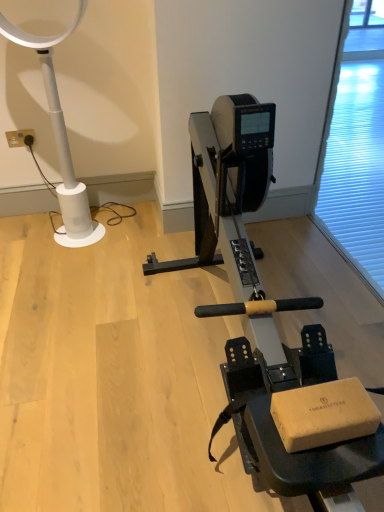
The height and width of the screenshot is (512, 384). I want to click on transparent plastic screen door at right, so click(355, 149).

You are a GUI agent. You are given a task and a screenshot of the screen. Output one action in this format:
    pyautogui.click(x=<x>, y=<y>)
    Task: Click on the white plastic lamp at left
    Image resolution: width=384 pixels, height=512 pixels.
    Given the screenshot: What is the action you would take?
    pyautogui.click(x=61, y=140)

What do you see at coordinates (61, 140) in the screenshot? The width and height of the screenshot is (384, 512). I see `white plastic lamp at left` at bounding box center [61, 140].

This screenshot has height=512, width=384. I want to click on metallic silver stationary bicycle at center, so click(x=261, y=310).

From the image's perspective, is metallic silver stationary bicycle at center above white plastic lamp at left?

No.

Considering the positions of objects metallic silver stationary bicycle at center and white plastic lamp at left in the image provided, who is more to the left, metallic silver stationary bicycle at center or white plastic lamp at left?

white plastic lamp at left.

Would you say metallic silver stationary bicycle at center is a long distance from white plastic lamp at left?

No, metallic silver stationary bicycle at center is not far away from white plastic lamp at left.

From the picture: Is white plastic electric outlet at upper left taller than metallic silver stationary bicycle at center?

No, white plastic electric outlet at upper left is not taller than metallic silver stationary bicycle at center.

Do you think white plastic electric outlet at upper left is within metallic silver stationary bicycle at center, or outside of it?

white plastic electric outlet at upper left is located beyond the bounds of metallic silver stationary bicycle at center.

I want to click on electric outlet lying above the metallic silver stationary bicycle at center (from the image's perspective), so click(x=20, y=138).

How distant is white plastic electric outlet at upper left from metallic silver stationary bicycle at center?

white plastic electric outlet at upper left is 4.95 feet from metallic silver stationary bicycle at center.

Is transparent plastic screen door at right next to white plastic lamp at left and touching it?

transparent plastic screen door at right is not next to white plastic lamp at left, and they're not touching.

Based on their positions, is transparent plastic screen door at right located to the left or right of white plastic lamp at left?

transparent plastic screen door at right is to the right of white plastic lamp at left.

From the image's perspective, who appears lower, transparent plastic screen door at right or white plastic lamp at left?

From the image's view, transparent plastic screen door at right is below.

Can you confirm if transparent plastic screen door at right is taller than white plastic electric outlet at upper left?

Yes, transparent plastic screen door at right is taller than white plastic electric outlet at upper left.

Consider the image. Is transparent plastic screen door at right further to the viewer compared to white plastic electric outlet at upper left?

No, the depth of transparent plastic screen door at right is less than that of white plastic electric outlet at upper left.

Is the surface of transparent plastic screen door at right in direct contact with white plastic electric outlet at upper left?

No, transparent plastic screen door at right is not making contact with white plastic electric outlet at upper left.

Which is behind, point (345, 190) or point (13, 135)?

The point (345, 190) is behind.

Considering the relative sizes of white plastic electric outlet at upper left and white plastic lamp at left in the image provided, is white plastic electric outlet at upper left wider than white plastic lamp at left?

In fact, white plastic electric outlet at upper left might be narrower than white plastic lamp at left.

Find the location of `electric outlet on the left of white plastic lamp at left`. electric outlet on the left of white plastic lamp at left is located at coordinates pyautogui.click(x=20, y=138).

Is white plastic electric outlet at upper left taller or shorter than white plastic lamp at left?

Clearly, white plastic electric outlet at upper left is shorter compared to white plastic lamp at left.

Based on their positions, is white plastic electric outlet at upper left located to the left or right of white plastic lamp at left?

white plastic electric outlet at upper left is to the left of white plastic lamp at left.

From the image's perspective, which is above, white plastic lamp at left or metallic silver stationary bicycle at center?

white plastic lamp at left, from the image's perspective.

From a real-world perspective, is white plastic lamp at left on metallic silver stationary bicycle at center?

Result: Yes, from a real-world perspective, white plastic lamp at left is over metallic silver stationary bicycle at center

Which of these two, white plastic lamp at left or metallic silver stationary bicycle at center, stands taller?

white plastic lamp at left is taller.

Is metallic silver stationary bicycle at center surrounding transparent plastic screen door at right?

No, transparent plastic screen door at right is not a part of metallic silver stationary bicycle at center.

Does metallic silver stationary bicycle at center come in front of transparent plastic screen door at right?

Yes, it is in front of transparent plastic screen door at right.

Which is closer, [250,383] or [358,135]?

The point [250,383] is closer.

Is metallic silver stationary bicycle at center looking in the opposite direction of transparent plastic screen door at right?

Yes, metallic silver stationary bicycle at center's orientation is away from transparent plastic screen door at right.

Where is `stationary bicycle on the right of white plastic lamp at left`? stationary bicycle on the right of white plastic lamp at left is located at coordinates (261, 310).

Where is `stationary bicycle below the white plastic electric outlet at upper left (from the image's perspective)`? stationary bicycle below the white plastic electric outlet at upper left (from the image's perspective) is located at coordinates click(261, 310).

In the scene shown: When comparing their distances from white plastic electric outlet at upper left, does transparent plastic screen door at right or white plastic lamp at left seem closer?

white plastic lamp at left lies closer to white plastic electric outlet at upper left than the other object.

When comparing their distances from white plastic electric outlet at upper left, does white plastic lamp at left or transparent plastic screen door at right seem closer?

Among the two, white plastic lamp at left is located nearer to white plastic electric outlet at upper left.

Based on their spatial positions, is transparent plastic screen door at right or white plastic electric outlet at upper left closer to metallic silver stationary bicycle at center?

transparent plastic screen door at right lies closer to metallic silver stationary bicycle at center than the other object.

Based on their spatial positions, is metallic silver stationary bicycle at center or white plastic lamp at left closer to white plastic electric outlet at upper left?

white plastic lamp at left lies closer to white plastic electric outlet at upper left than the other object.

When comparing their distances from metallic silver stationary bicycle at center, does white plastic lamp at left or transparent plastic screen door at right seem further?

white plastic lamp at left is positioned further to the anchor metallic silver stationary bicycle at center.

Which object lies nearer to the anchor point transparent plastic screen door at right, white plastic electric outlet at upper left or white plastic lamp at left?

The object closer to transparent plastic screen door at right is white plastic lamp at left.

Based on their spatial positions, is transparent plastic screen door at right or white plastic lamp at left further from metallic silver stationary bicycle at center?

white plastic lamp at left.

Estimate the real-world distances between objects in this image. Which object is further from metallic silver stationary bicycle at center, white plastic electric outlet at upper left or transparent plastic screen door at right?

white plastic electric outlet at upper left is positioned further to the anchor metallic silver stationary bicycle at center.

Locate an element on the screen. The width and height of the screenshot is (384, 512). screen door between metallic silver stationary bicycle at center and white plastic electric outlet at upper left along the z-axis is located at coordinates (355, 149).

The width and height of the screenshot is (384, 512). In order to click on lamp between white plastic electric outlet at upper left and transparent plastic screen door at right in the horizontal direction in this screenshot , I will do `click(61, 140)`.

The image size is (384, 512). In order to click on lamp between metallic silver stationary bicycle at center and white plastic electric outlet at upper left in the front-back direction in this screenshot , I will do `click(61, 140)`.

You are a GUI agent. You are given a task and a screenshot of the screen. Output one action in this format:
    pyautogui.click(x=<x>, y=<y>)
    Task: Click on the stationary bicycle situated between white plastic lamp at left and transparent plastic screen door at right from left to right
    
    Given the screenshot: What is the action you would take?
    pyautogui.click(x=261, y=310)